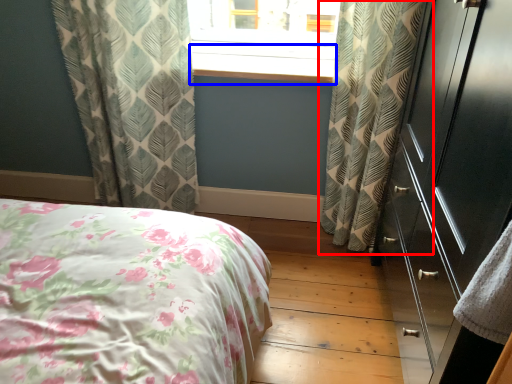
Question: Which point is further to the camera, curtain (highlighted by a red box) or window sill (highlighted by a blue box)?

Choices:
 (A) curtain
 (B) window sill

Answer: (B)